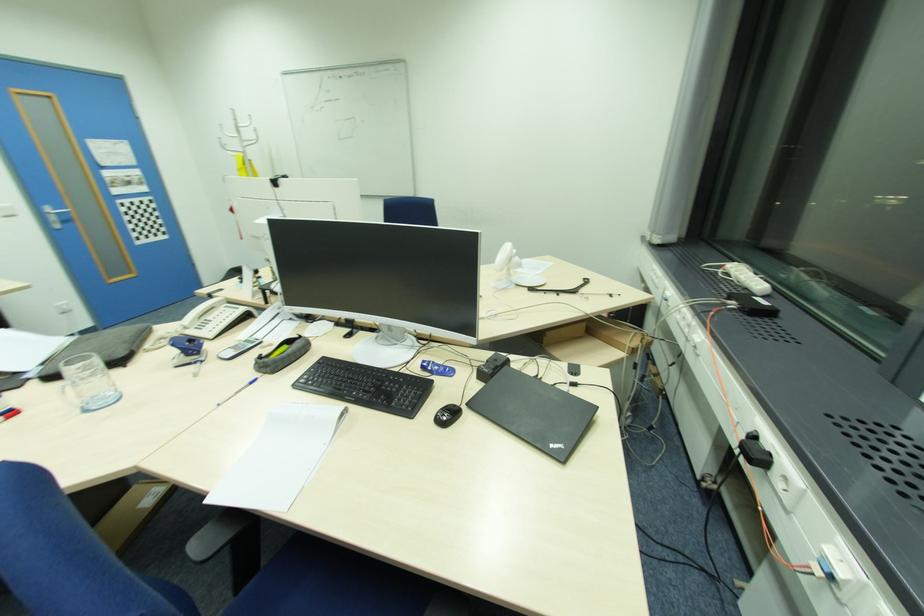
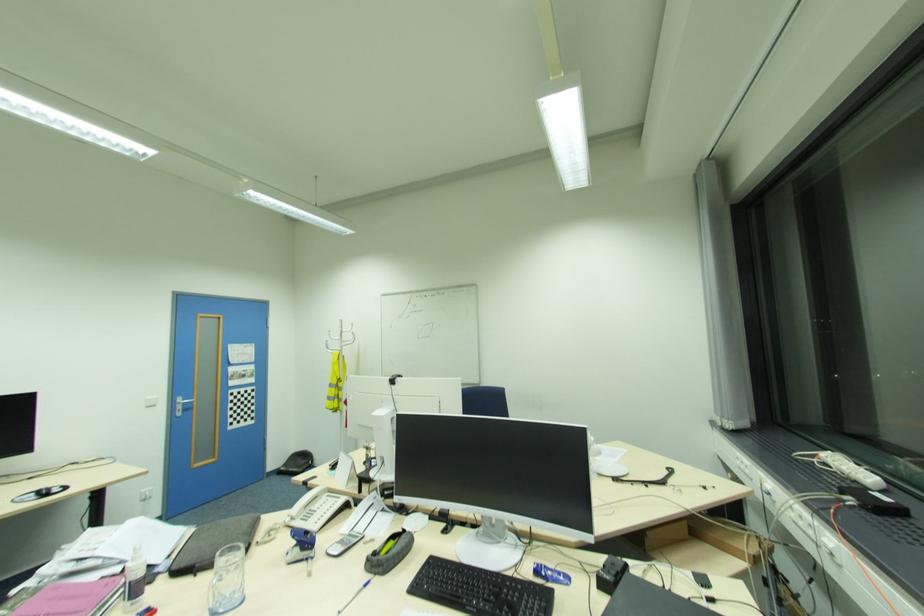
Where in the second image is the point corresponding to pixel 185 325 from the first image?

(292, 516)